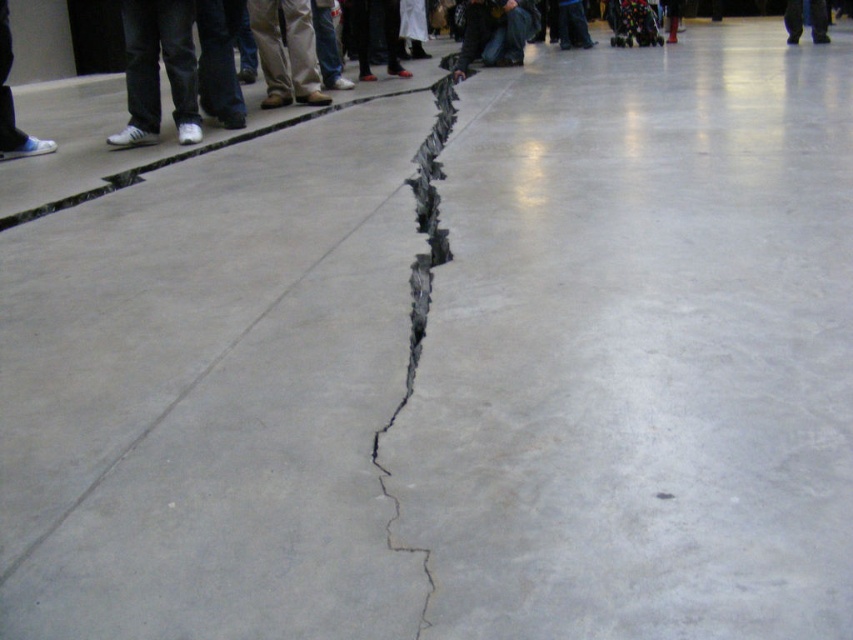
Can you confirm if white matte shoe at lower left is bigger than black leather pants at right?

Indeed, white matte shoe at lower left has a larger size compared to black leather pants at right.

Who is shorter, white matte shoe at lower left or black leather pants at right?

black leather pants at right

The height and width of the screenshot is (640, 853). What are the coordinates of `white matte shoe at lower left` in the screenshot? It's located at (12, 104).

Is white leather shoes at left wider than gray concrete crack at center?

Correct, the width of white leather shoes at left exceeds that of gray concrete crack at center.

Does point (126, 58) come behind point (438, 99)?

No, (126, 58) is closer to viewer.

Is point (194, 72) closer to camera compared to point (418, 216)?

No, (194, 72) is behind (418, 216).

The width and height of the screenshot is (853, 640). What are the coordinates of `white leather shoes at left` in the screenshot? It's located at (158, 68).

Can you confirm if white leather shoes at left is positioned to the left of white matte shoe at lower left?

Incorrect, white leather shoes at left is not on the left side of white matte shoe at lower left.

Consider the image. Who is more forward, (x=131, y=45) or (x=16, y=148)?

Point (x=131, y=45)

Between point (144, 65) and point (4, 52), which one is positioned in front?

Point (4, 52)

Locate an element on the screen. Image resolution: width=853 pixels, height=640 pixels. white leather shoes at left is located at coordinates (158, 68).